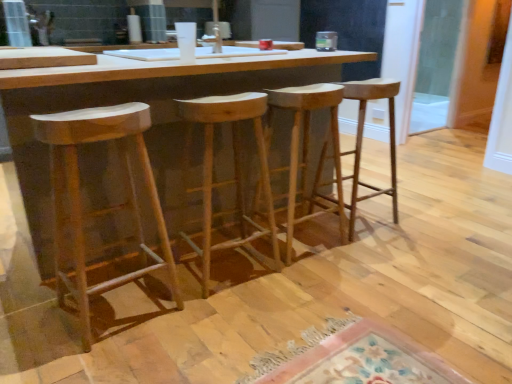
Where is `unoccupied area in front of natural wood stool at center, the 1th stool in the right-to-left sequence`? This screenshot has height=384, width=512. unoccupied area in front of natural wood stool at center, the 1th stool in the right-to-left sequence is located at coordinates (374, 253).